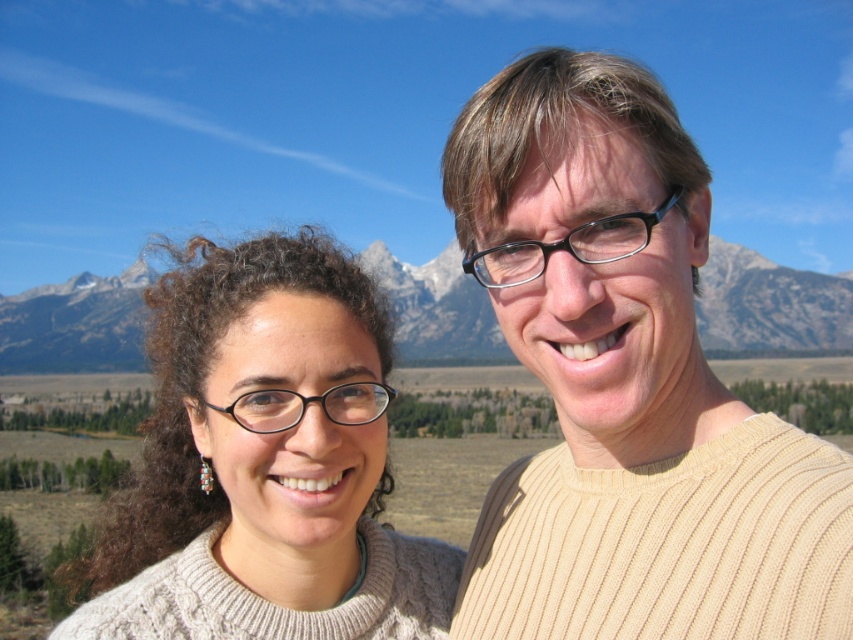
Question: Considering the relative positions of knitted sweater at center and snowy granite mountain at center in the image provided, where is knitted sweater at center located with respect to snowy granite mountain at center?

Choices:
 (A) below
 (B) above

Answer: (A)

Question: Can you confirm if knitted sweater at center is positioned to the right of snowy granite mountain at center?

Choices:
 (A) no
 (B) yes

Answer: (B)

Question: Among these objects, which one is farthest from the camera?

Choices:
 (A) snowy granite mountain at center
 (B) knitted sweater at center

Answer: (A)

Question: Which of the following is the farthest from the observer?

Choices:
 (A) (274, 620)
 (B) (505, 348)

Answer: (B)

Question: Is the position of knitted sweater at center less distant than that of snowy granite mountain at center?

Choices:
 (A) no
 (B) yes

Answer: (B)